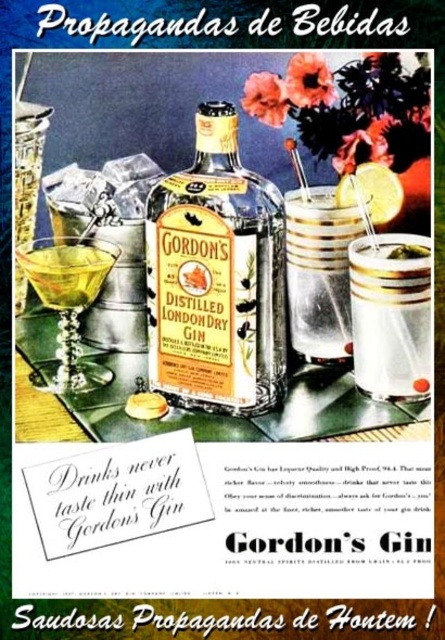
Does shiny gold martini glass at lower left appear on the left side of yellow matte lemon at upper right?

Correct, you'll find shiny gold martini glass at lower left to the left of yellow matte lemon at upper right.

Where is `shiny gold martini glass at lower left`? The image size is (445, 640). shiny gold martini glass at lower left is located at coordinates (68, 301).

Describe the element at coordinates (217, 276) in the screenshot. The image size is (445, 640). I see `matte glass bottle at center` at that location.

Which is behind, point (198, 189) or point (291, 246)?

Positioned behind is point (291, 246).

In the scene shown: Measure the distance between point (153, 330) and camera.

Point (153, 330) and camera are 25.82 inches apart.

Identify the location of matte glass bottle at center. Image resolution: width=445 pixels, height=640 pixels. (217, 276).

Which of these two, clear plastic cup at center or shiny gold martini glass at lower left, stands taller?

clear plastic cup at center is taller.

Does point (400, 339) come farther from viewer compared to point (71, 260)?

No, (400, 339) is closer to viewer.

Locate an element on the screen. This screenshot has height=640, width=445. clear plastic cup at center is located at coordinates (391, 314).